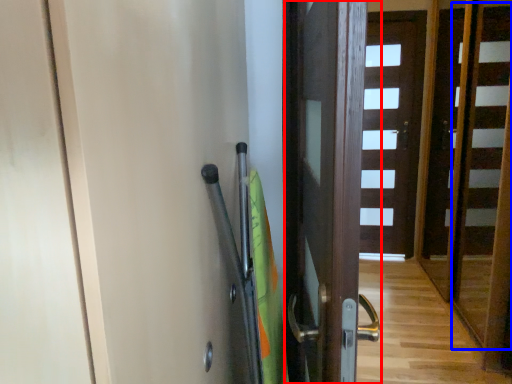
Question: Which point is closer to the camera, door (highlighted by a red box) or stair (highlighted by a blue box)?

Choices:
 (A) door
 (B) stair

Answer: (A)